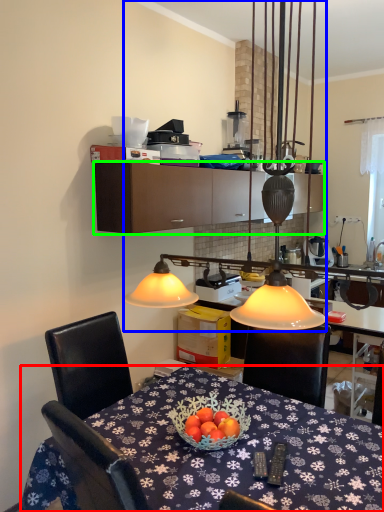
Question: Which object is positioned closest to desk (highlighted by a red box)? Select from lamp (highlighted by a blue box) and cabinetry (highlighted by a green box).

Choices:
 (A) lamp
 (B) cabinetry

Answer: (A)